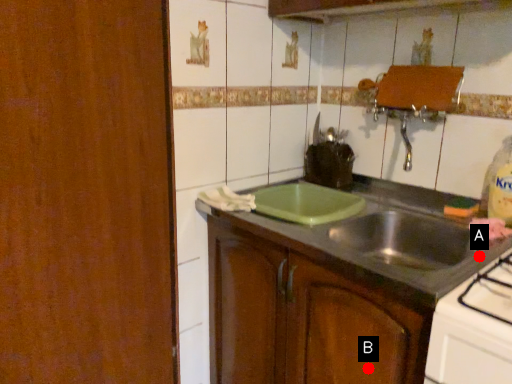
Question: Two points are circled on the image, labeled by A and B beside each circle. Which point is closer to the camera taking this photo?

Choices:
 (A) A is closer
 (B) B is closer

Answer: (B)